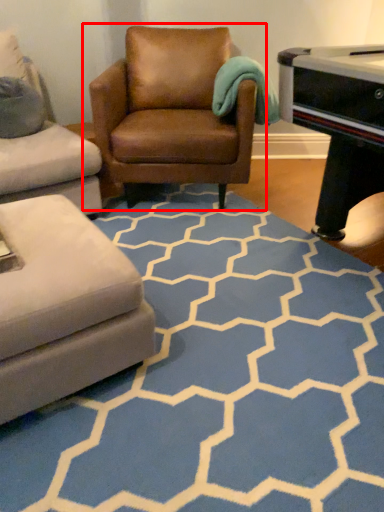
Question: In this image, where is chair (annotated by the red box) located relative to pattern?

Choices:
 (A) right
 (B) left

Answer: (B)